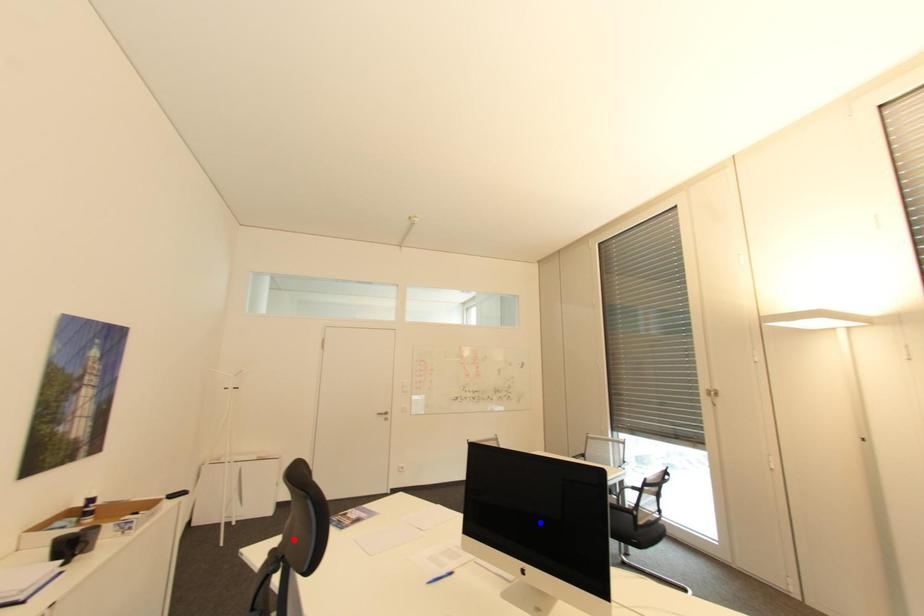
Question: Which of the two points in the image is closer to the camera?

Choices:
 (A) Blue point is closer.
 (B) Red point is closer.

Answer: (B)